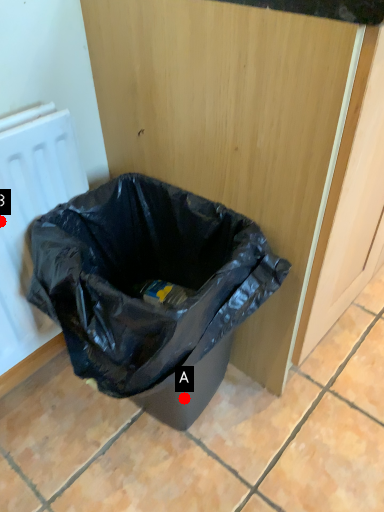
Question: Two points are circled on the image, labeled by A and B beside each circle. Which point is further to the camera?

Choices:
 (A) A is further
 (B) B is further

Answer: (A)